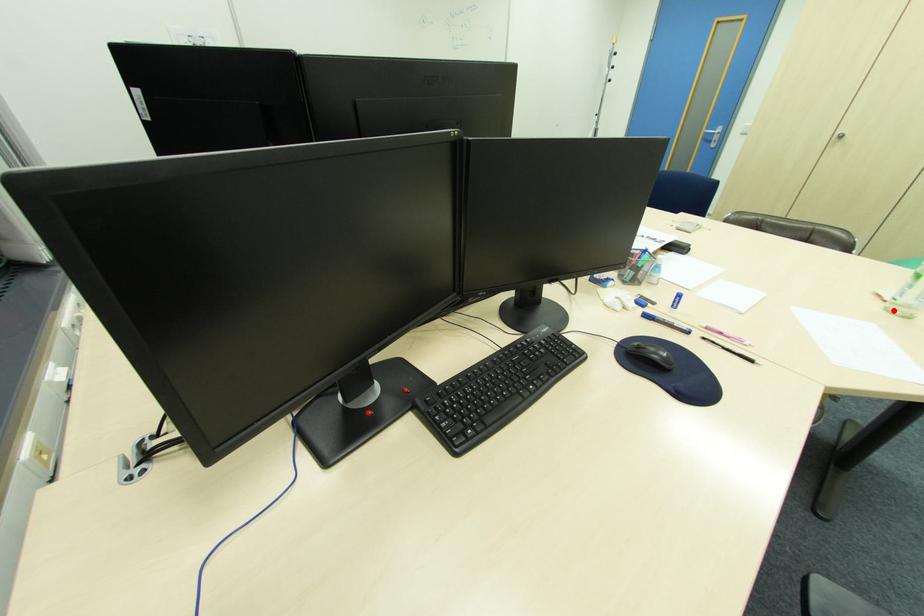
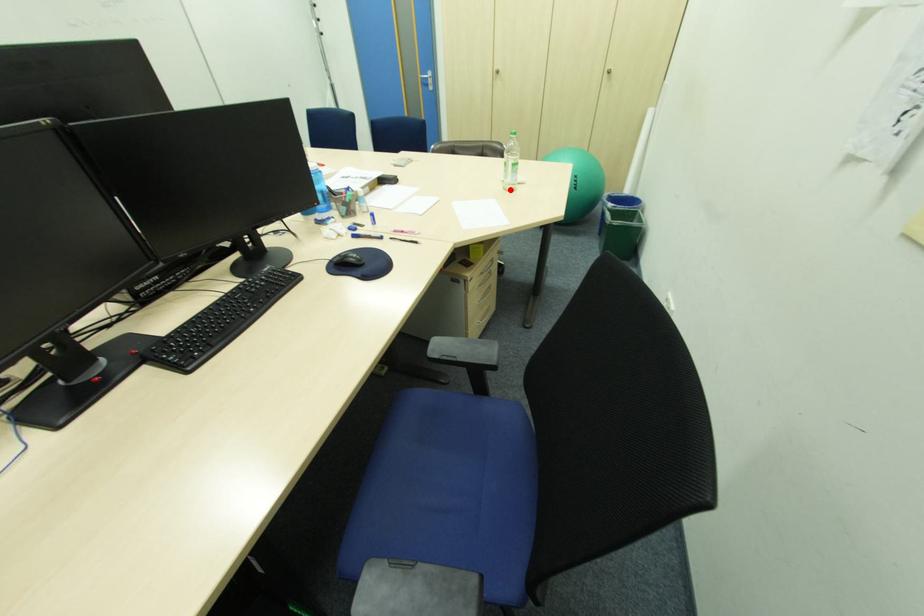
I am providing you with two images of the same scene from different viewpoints. A red point is marked on the first image and another point is marked on the second image. Are the points marked in image1 and image2 representing the same 3D position?

Yes